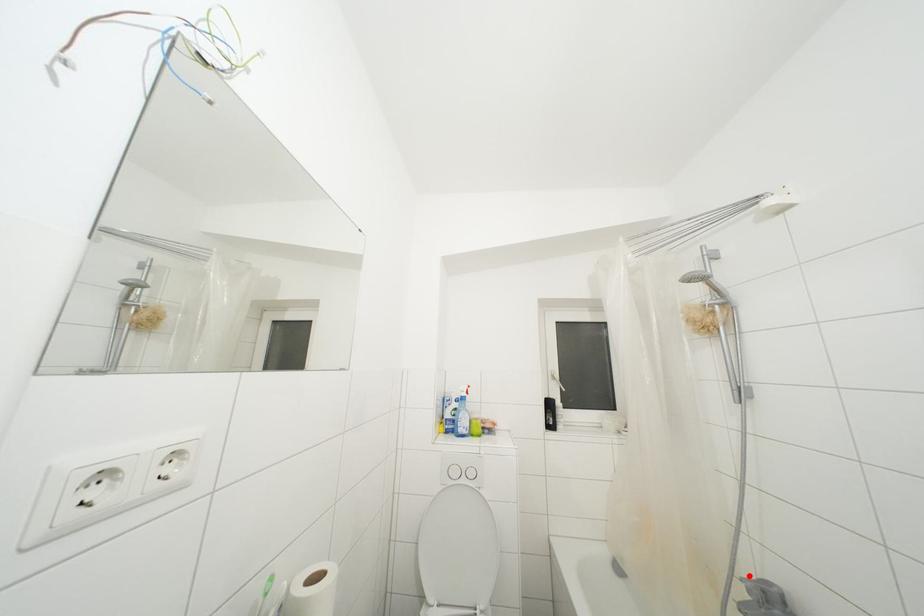
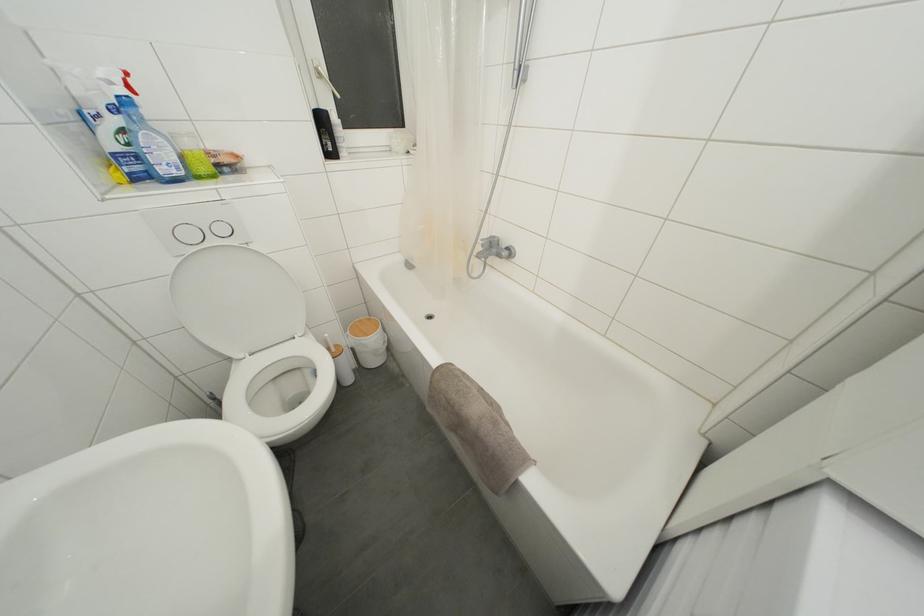
In the second image, find the point that corresponds to the highlighted location in the first image.

(488, 240)